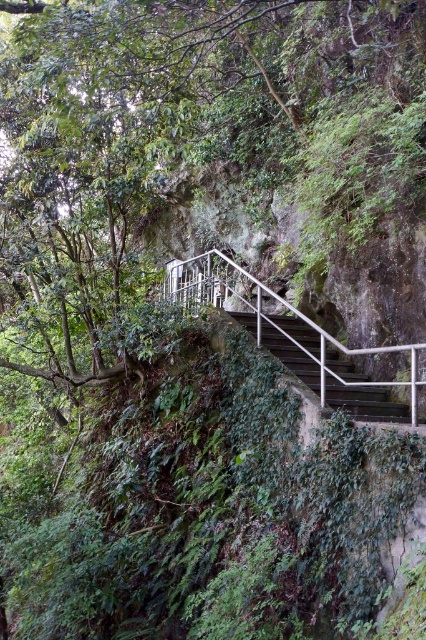
Who is positioned more to the left, green leafy tree at upper left or metallic silver balustrade at center?

Positioned to the left is green leafy tree at upper left.

Locate an element on the screen. The width and height of the screenshot is (426, 640). green leafy tree at upper left is located at coordinates (192, 131).

Is point (40, 340) behind point (245, 272)?

That is False.

This screenshot has height=640, width=426. I want to click on green leafy tree at upper left, so click(x=192, y=131).

Does metallic silver balustrade at center appear over metallic gray stairs at center?

Correct, metallic silver balustrade at center is located above metallic gray stairs at center.

Who is taller, metallic silver balustrade at center or metallic gray stairs at center?

metallic silver balustrade at center

Where is `metallic silver balustrade at center`? This screenshot has height=640, width=426. metallic silver balustrade at center is located at coordinates (275, 320).

Is green leafy tree at upper left wider than metallic gray stairs at center?

No, green leafy tree at upper left is not wider than metallic gray stairs at center.

How much distance is there between green leafy tree at upper left and metallic gray stairs at center?

The distance of green leafy tree at upper left from metallic gray stairs at center is 4.23 meters.

This screenshot has width=426, height=640. What do you see at coordinates (192, 131) in the screenshot?
I see `green leafy tree at upper left` at bounding box center [192, 131].

Locate an element on the screen. The image size is (426, 640). green leafy tree at upper left is located at coordinates (192, 131).